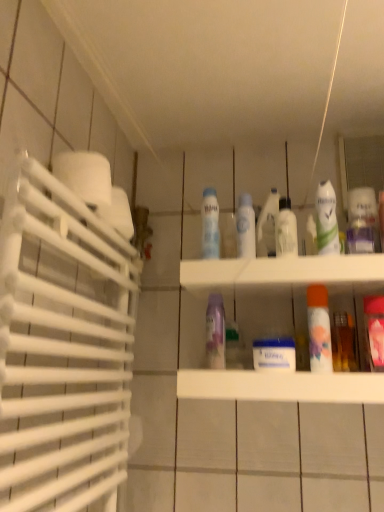
Question: Is purple glossy spray can at center, the fourth cleaning product in the right-to-left sequence, wider or thinner than pink glossy mouthwash at right, placed as the 4th mouthwash when sorted from left to right?

Choices:
 (A) wide
 (B) thin

Answer: (B)

Question: Do you think purple glossy spray can at center, acting as the second cleaning product starting from the left, is within pink glossy mouthwash at right, which ranks as the 1th mouthwash in right-to-left order, or outside of it?

Choices:
 (A) outside
 (B) inside

Answer: (A)

Question: Which object is positioned farthest from the translucent plastic spray can at upper right, acting as the 5th cleaning product starting from the left?

Choices:
 (A) translucent plastic bottles at center
 (B) orange matte mouthwash at center-right, which is the 2th mouthwash in right-to-left order
 (C) clear plastic bottle at center, arranged as the 3th mouthwash when viewed from the right
 (D) white matte toilet paper at left
 (E) white glossy deodorant at upper right, the second cleaning product from the right

Answer: (D)

Question: Based on their relative distances, which object is nearer to the translucent plastic spray bottle at center, the 3th cleaning product viewed from the right?

Choices:
 (A) white matte toilet paper at left
 (B) purple glossy spray can at center, the fourth cleaning product in the right-to-left sequence
 (C) translucent plastic spray can at upper right, marked as the first cleaning product in a right-to-left arrangement
 (D) white matte spray can at center, positioned as the 5th cleaning product in right-to-left order
 (E) white glossy deodorant at upper right, the second cleaning product from the right

Answer: (E)